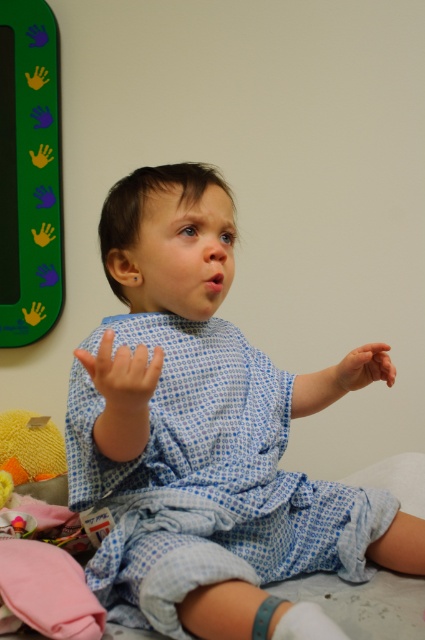
Can you confirm if blue checkered gown at center is taller than matte blue fabric hand at lower left?

Yes, blue checkered gown at center is taller than matte blue fabric hand at lower left.

Based on the photo, is blue checkered gown at center positioned at the back of matte blue fabric hand at lower left?

Yes, it is behind matte blue fabric hand at lower left.

Where is `blue checkered gown at center`? The image size is (425, 640). blue checkered gown at center is located at coordinates (206, 436).

From the picture: Between yellow fuzzy toy at lower left and matte blue fabric hand at center, which one appears on the right side from the viewer's perspective?

Positioned to the right is matte blue fabric hand at center.

Who is lower down, yellow fuzzy toy at lower left or matte blue fabric hand at center?

Positioned lower is yellow fuzzy toy at lower left.

Who is more forward, (x=5, y=419) or (x=351, y=352)?

Positioned in front is point (x=351, y=352).

This screenshot has height=640, width=425. Find the location of `yellow fuzzy toy at lower left`. yellow fuzzy toy at lower left is located at coordinates (30, 448).

Can you confirm if matte blue fabric hand at lower left is positioned to the left of yellow fuzzy toy at lower left?

No, matte blue fabric hand at lower left is not to the left of yellow fuzzy toy at lower left.

Between matte blue fabric hand at lower left and yellow fuzzy toy at lower left, which one appears on the right side from the viewer's perspective?

Positioned to the right is matte blue fabric hand at lower left.

Between point (110, 406) and point (22, 413), which one is positioned in front?

Point (110, 406) is in front.

You are a GUI agent. You are given a task and a screenshot of the screen. Output one action in this format:
    pyautogui.click(x=<x>, y=<y>)
    Task: Click on the matte blue fabric hand at lower left
    Image resolution: width=425 pixels, height=640 pixels.
    Given the screenshot: What is the action you would take?
    pyautogui.click(x=122, y=376)